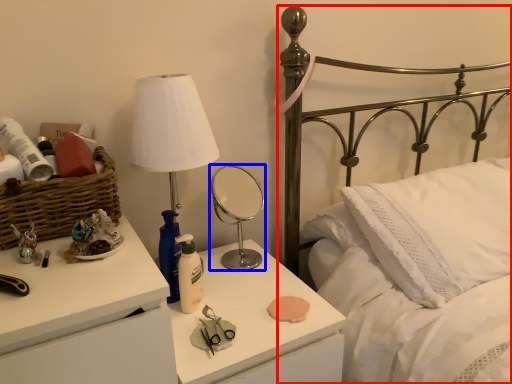
Question: Which object appears farthest to the camera in this image, bed (highlighted by a red box) or mirror (highlighted by a blue box)?

Choices:
 (A) bed
 (B) mirror

Answer: (B)